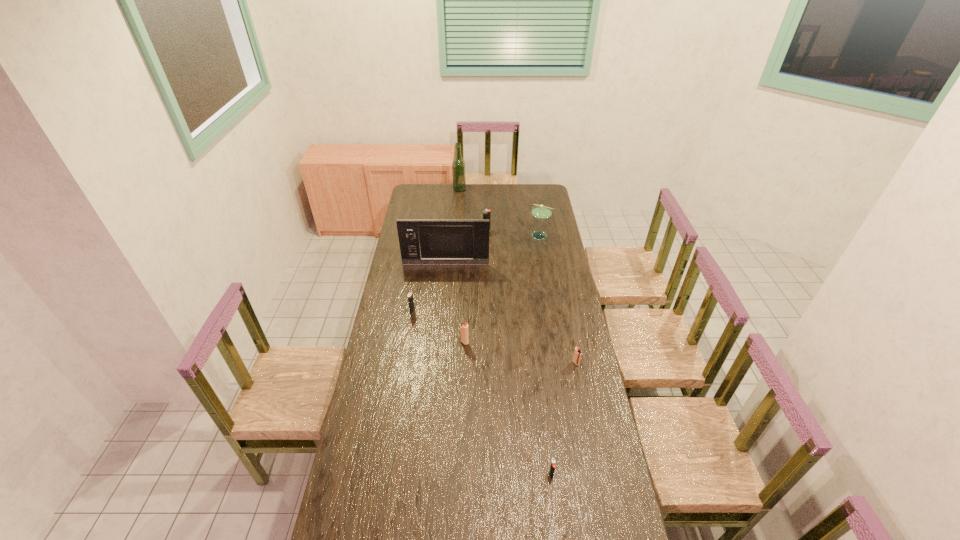
The width and height of the screenshot is (960, 540). In order to click on the third farthest igniter in this screenshot , I will do (x=464, y=337).

I want to click on the farther red igniter, so click(x=464, y=337).

This screenshot has width=960, height=540. Identify the location of the smaller red igniter. (577, 353).

Find the location of `the second nearest object`. the second nearest object is located at coordinates (577, 353).

At what (x,y) coordinates should I click in order to perform the action: click on the nearest object. Please return your answer as a coordinate pair (x, y). This screenshot has height=540, width=960. Looking at the image, I should click on 552,468.

In order to click on the fourth igniter from left to right in this screenshot , I will do `click(552, 468)`.

The height and width of the screenshot is (540, 960). Find the location of `vacant space situated 0.390m on the right of the liquor`. vacant space situated 0.390m on the right of the liquor is located at coordinates (524, 189).

Where is `free space located 0.330m on the front panel of the fourth farthest object`? Image resolution: width=960 pixels, height=540 pixels. free space located 0.330m on the front panel of the fourth farthest object is located at coordinates (442, 309).

Image resolution: width=960 pixels, height=540 pixels. Identify the location of vacant space located 0.390m on the left of the third tallest object. (462, 235).

Identify the location of blank space located 0.260m on the back of the tallest igniter. The image size is (960, 540). 486,206.